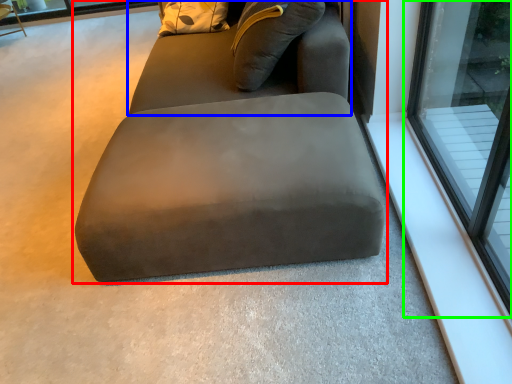
Question: Estimate the real-world distances between objects in this image. Which object is farther from studio couch (highlighted by a red box), bean bag chair (highlighted by a blue box) or window (highlighted by a green box)?

Choices:
 (A) bean bag chair
 (B) window

Answer: (B)